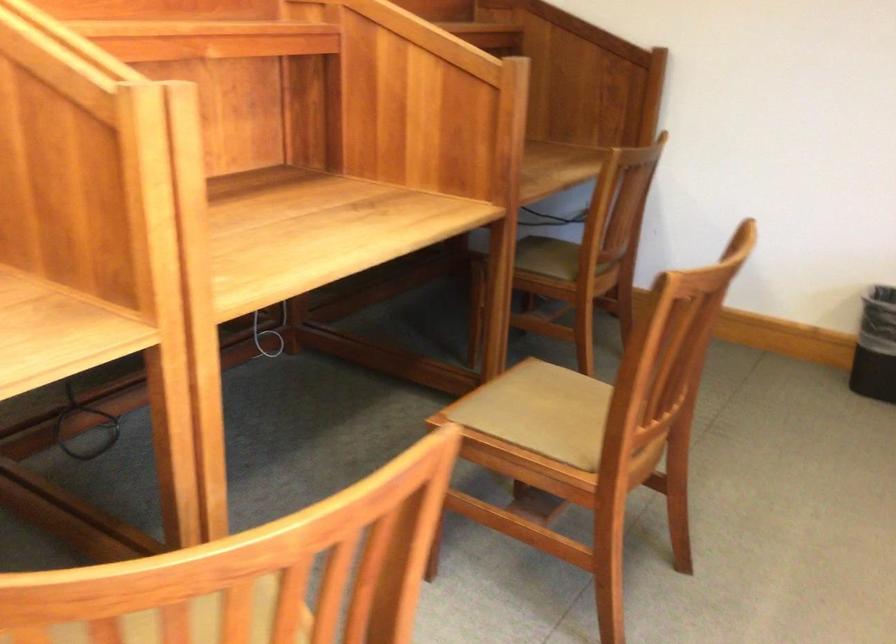
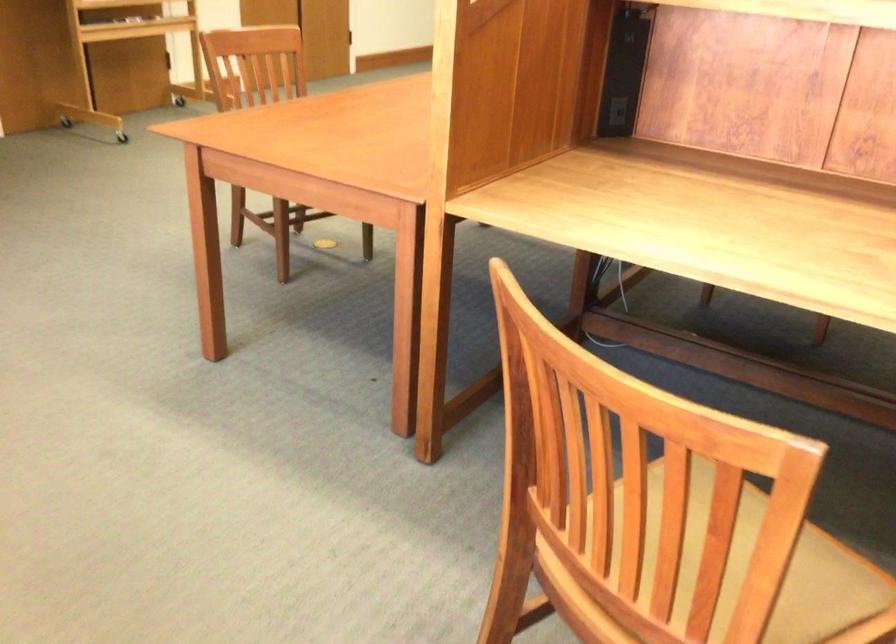
The images are taken continuously from a first-person perspective. In which direction is your viewpoint rotating?

The camera rotated toward left-down.